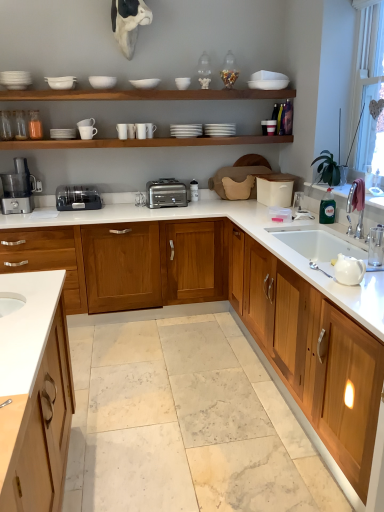
You are a GUI agent. You are given a task and a screenshot of the screen. Output one action in this format:
    pyautogui.click(x=<x>, y=<y>)
    Task: Click on the vacant point above white marble countertop at center, placed as the second countertop when sorted from top to bottom (from a real-world perspective)
    The image size is (384, 512).
    Given the screenshot: What is the action you would take?
    174,389